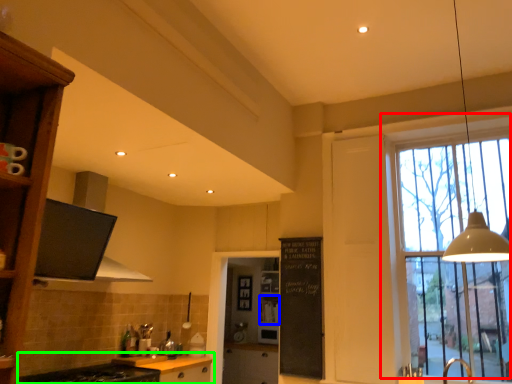
Question: Which object is positioned farthest from window (highlighted by a red box)? Select from shelf (highlighted by a blue box) and cabinetry (highlighted by a green box).

Choices:
 (A) shelf
 (B) cabinetry

Answer: (A)